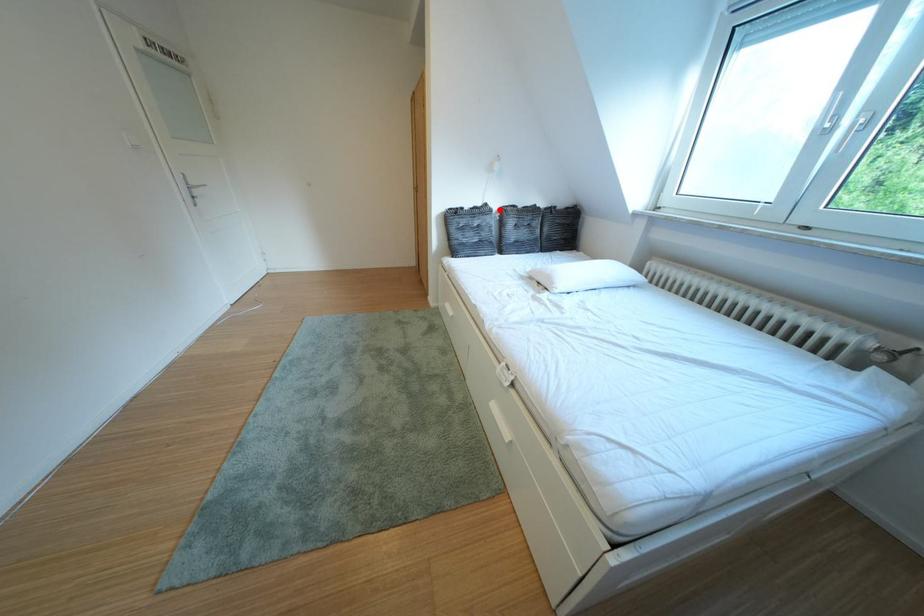
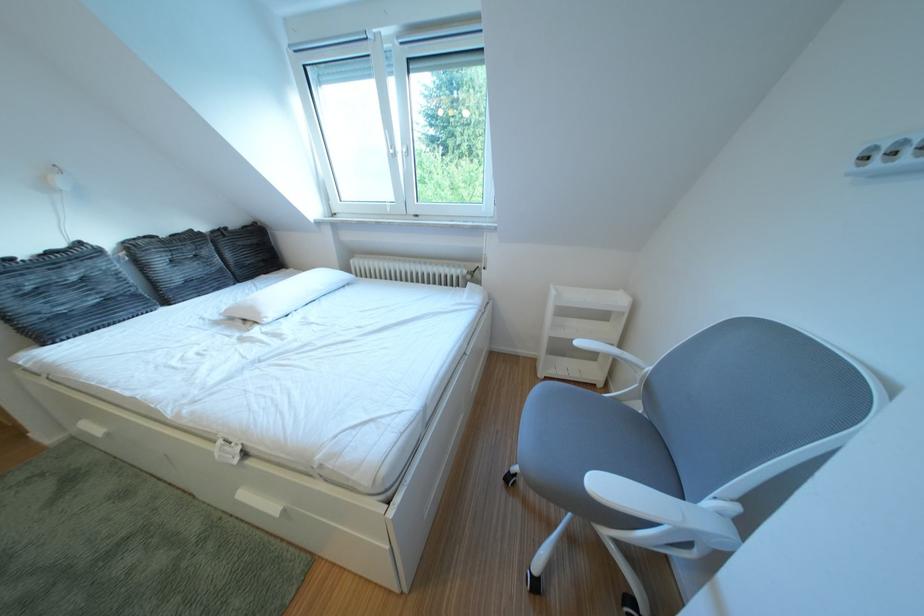
Question: A red point is marked in image1. In image2, is the corresponding 3D point closer to the camera or farther? Reply with the corresponding letter.

Choices:
 (A) The corresponding 3D point is closer.
 (B) The corresponding 3D point is farther.

Answer: (B)